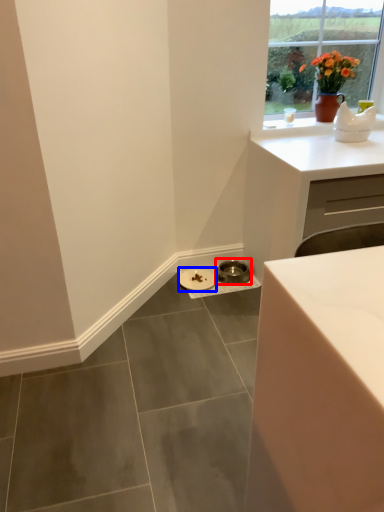
Question: Which object is further to the camera taking this photo, manhole cover (highlighted by a red box) or manhole cover (highlighted by a blue box)?

Choices:
 (A) manhole cover
 (B) manhole cover

Answer: (A)